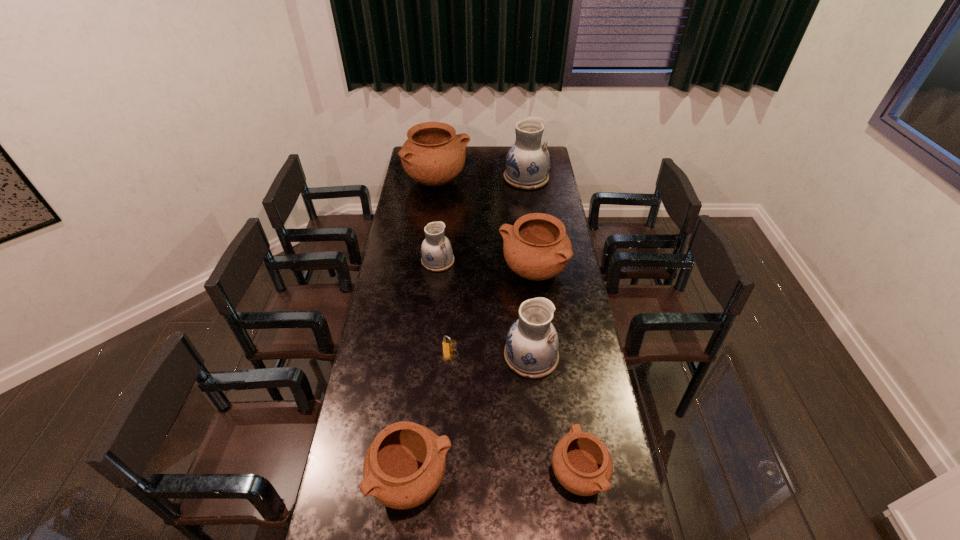
Locate an element on the screen. The height and width of the screenshot is (540, 960). the farthest blue pottery is located at coordinates [x=527, y=163].

Find the location of a particular element. the biggest terracotta pottery is located at coordinates (433, 155).

The image size is (960, 540). Find the location of `the second smallest blue pottery`. the second smallest blue pottery is located at coordinates (531, 350).

The width and height of the screenshot is (960, 540). In order to click on the fifth farthest pottery in this screenshot , I will do `click(531, 350)`.

Find the location of a particular element. This screenshot has width=960, height=540. the third smallest terracotta pottery is located at coordinates (536, 247).

The width and height of the screenshot is (960, 540). I want to click on the smallest blue pottery, so click(437, 255).

You are a GUI agent. You are given a task and a screenshot of the screen. Output one action in this format:
    pyautogui.click(x=<x>, y=<y>)
    Task: Click on the leftmost blue pottery
    
    Given the screenshot: What is the action you would take?
    pyautogui.click(x=437, y=255)

The image size is (960, 540). What are the coordinates of `the third biggest terracotta pottery` in the screenshot? It's located at (404, 466).

Where is `the smallest terracotta pottery`? the smallest terracotta pottery is located at coordinates (582, 464).

Find the location of a particular element. The height and width of the screenshot is (540, 960). the shortest pottery is located at coordinates (582, 464).